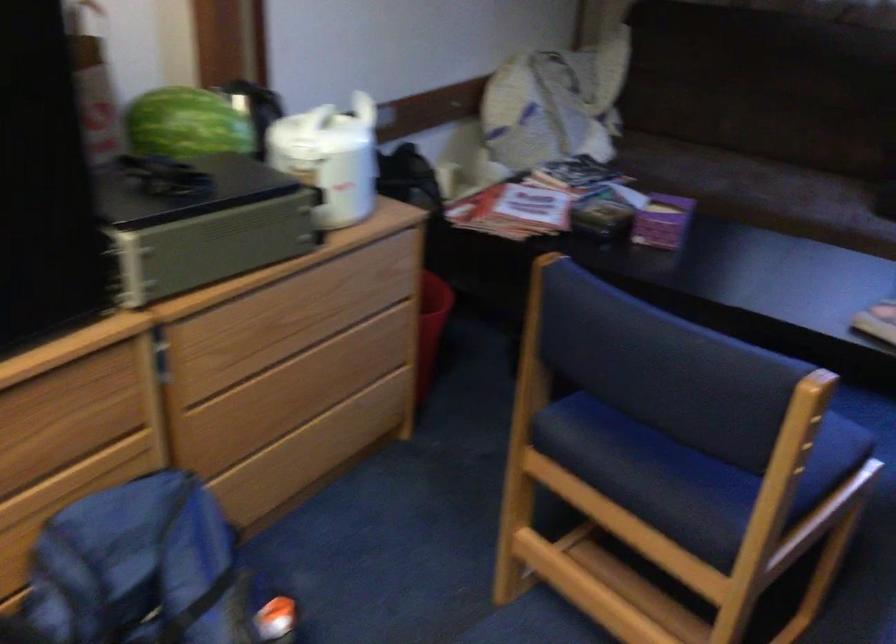
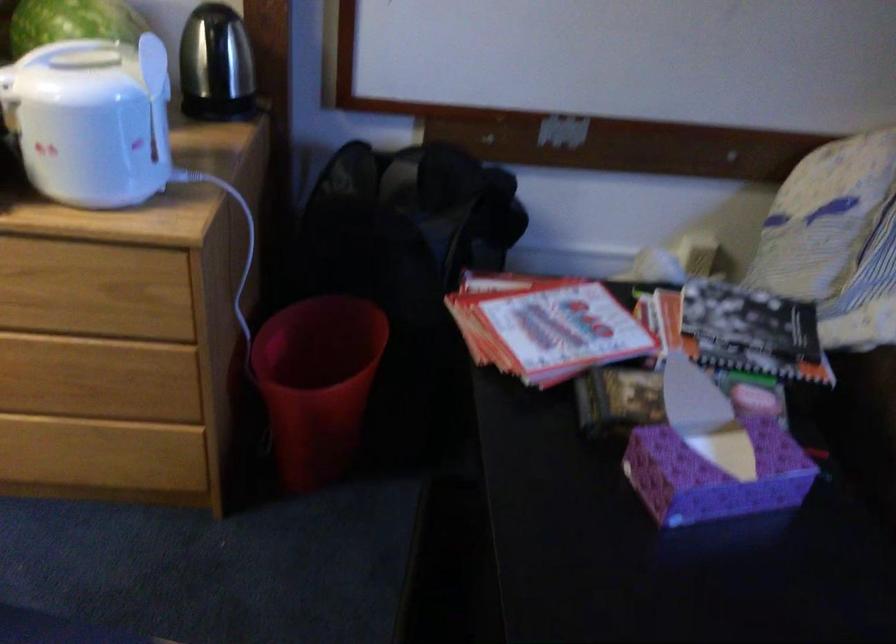
In the second image, find the point that corresponds to point 522,207 in the first image.

(545, 326)